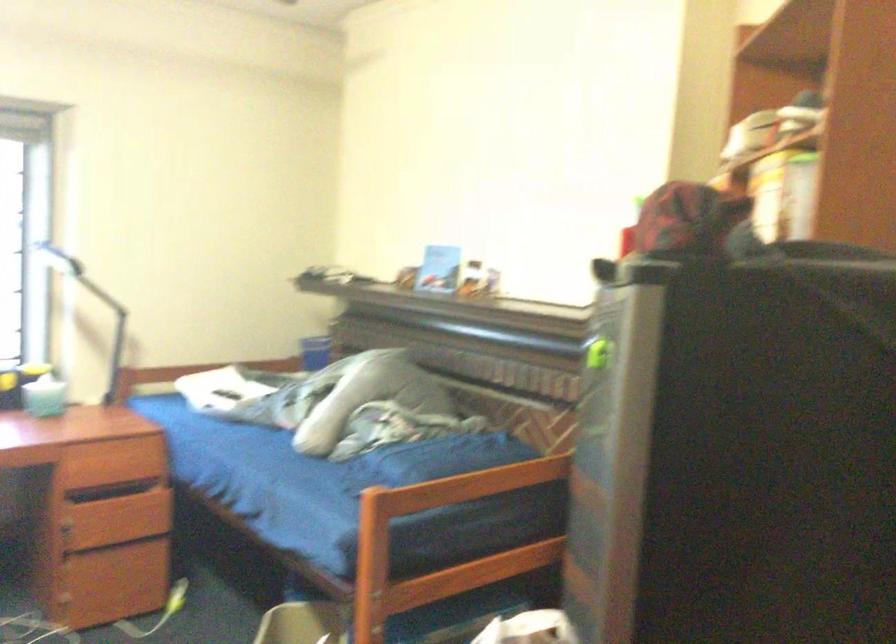
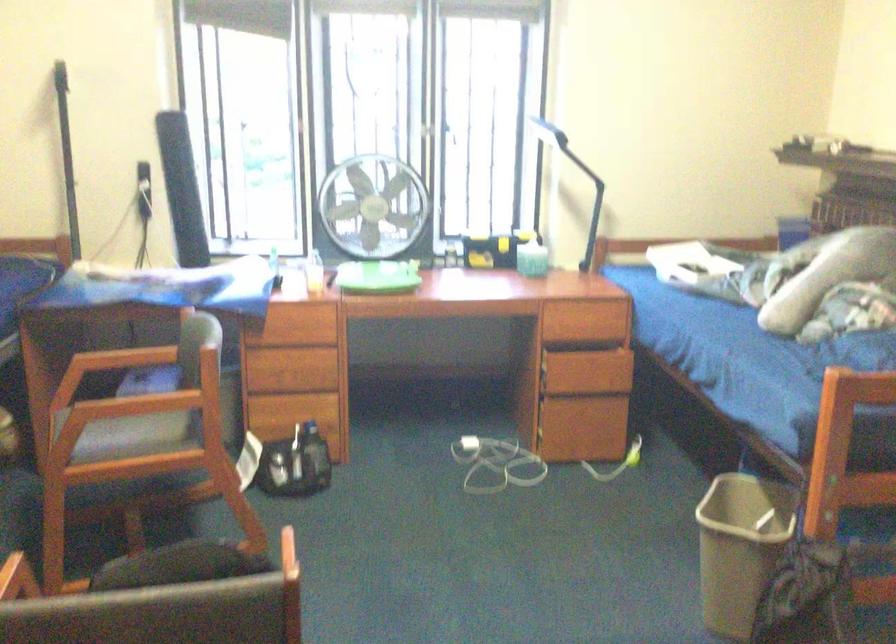
Find the pixel in the second image that matches point (274, 401) in the first image.

(745, 275)